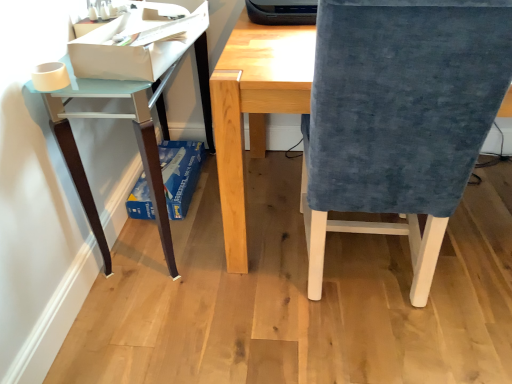
The image size is (512, 384). In order to click on vacant area in front of light blue glossy table at left in this screenshot , I will do `click(198, 313)`.